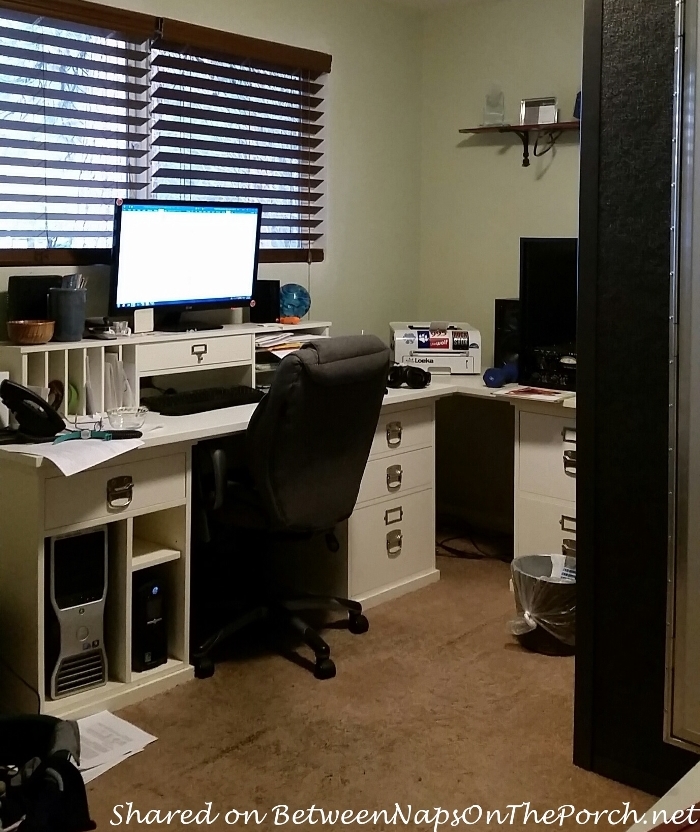
This screenshot has width=700, height=832. I want to click on desk, so click(x=215, y=410).